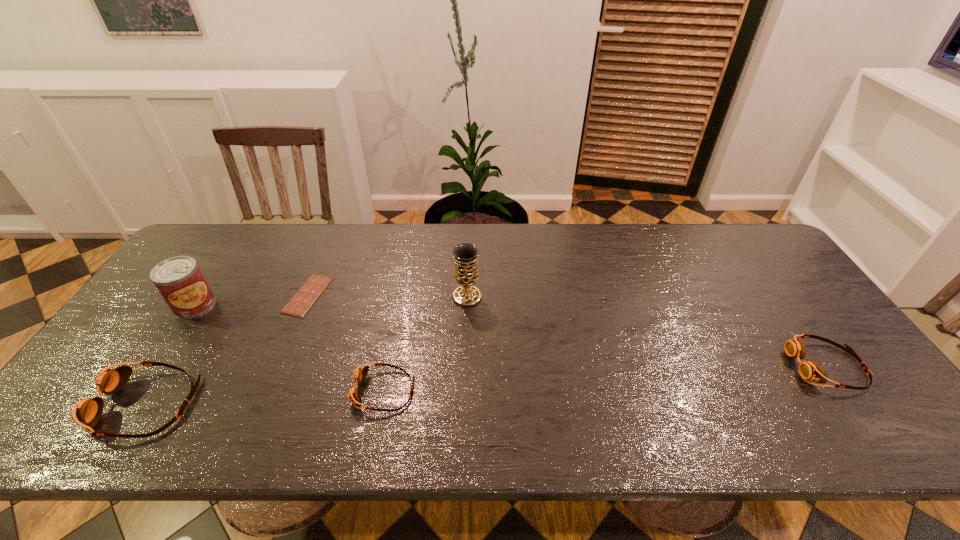
I want to click on the second closest object relative to the second goggles from left to right, so click(465, 255).

Where is `object that is the fifth nearest to the leftmost goggles`? The width and height of the screenshot is (960, 540). object that is the fifth nearest to the leftmost goggles is located at coordinates (809, 370).

Identify which goggles is the nearest to the second tallest object. Please provide its 2D coordinates. Your answer should be formatted as a tuple, i.e. [(x, y)], where the tuple contains the x and y coordinates of a point satisfying the conditions above.

[(87, 413)]

Image resolution: width=960 pixels, height=540 pixels. Find the location of `goggles that can be found as the third closest to the fifth object from left to right`. goggles that can be found as the third closest to the fifth object from left to right is located at coordinates (809, 370).

This screenshot has width=960, height=540. Find the location of `free space that satisfies the following two spatial constraints: 1. on the front side of the third object from left to right; 2. on the left side of the chalice`. free space that satisfies the following two spatial constraints: 1. on the front side of the third object from left to right; 2. on the left side of the chalice is located at coordinates (307, 296).

Identify the location of vacant space that satisfies the following two spatial constraints: 1. on the front side of the chalice; 2. with the lenses facing forward on the fifth tallest object. The image size is (960, 540). (464, 391).